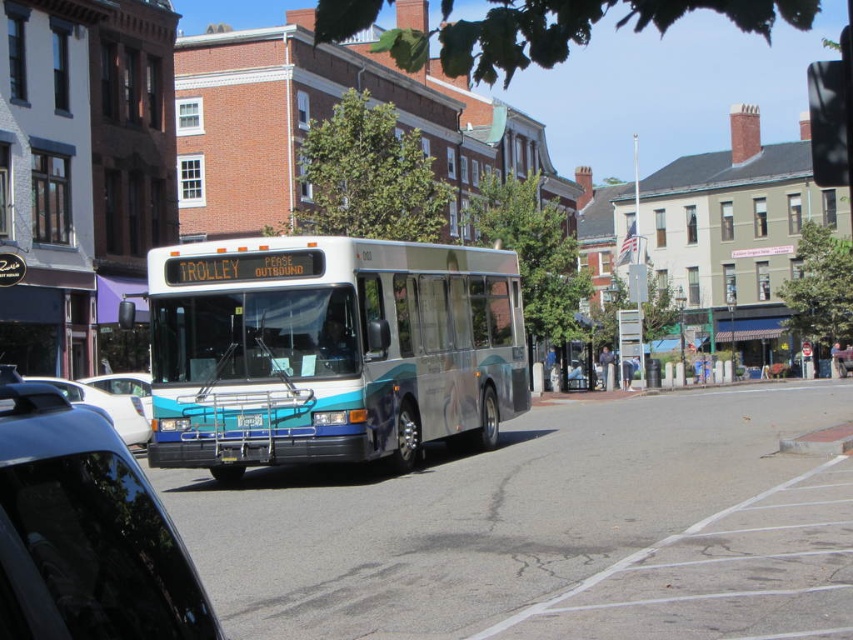
Question: Among these objects, which one is nearest to the camera?

Choices:
 (A) teal metallic bus at center
 (B) metallic silver car at lower left
 (C) white glossy sedan at lower left
 (D) black glossy car at left

Answer: (D)

Question: Can you confirm if teal metallic bus at center is thinner than black glossy car at left?

Choices:
 (A) no
 (B) yes

Answer: (B)

Question: Which object is the closest to the metallic silver car at lower left?

Choices:
 (A) black glossy car at left
 (B) teal metallic bus at center

Answer: (B)

Question: Can you confirm if teal metallic bus at center is bigger than black glossy car at left?

Choices:
 (A) yes
 (B) no

Answer: (B)

Question: Does teal metallic bus at center have a lesser width compared to blue metallic license plate at center?

Choices:
 (A) yes
 (B) no

Answer: (A)

Question: Which of the following is the farthest from the observer?

Choices:
 (A) metallic silver car at lower left
 (B) blue metallic license plate at center
 (C) white glossy sedan at lower left

Answer: (C)